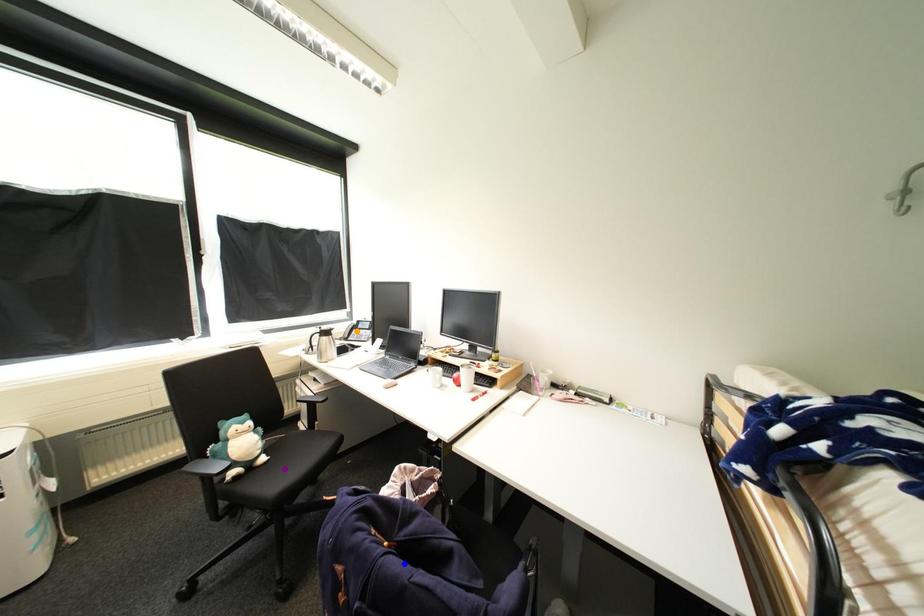
Order these from nearest to farthest:
orange point
blue point
purple point

blue point < purple point < orange point